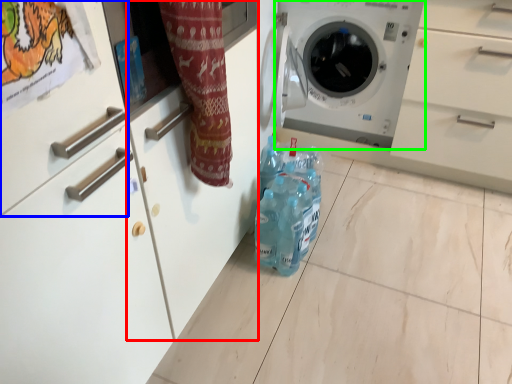
Question: Estimate the real-world distances between objects in this image. Which object is farther from cabinetry (highlighted by a red box), drawer (highlighted by a blue box) or washing machine (highlighted by a green box)?

Choices:
 (A) drawer
 (B) washing machine

Answer: (B)